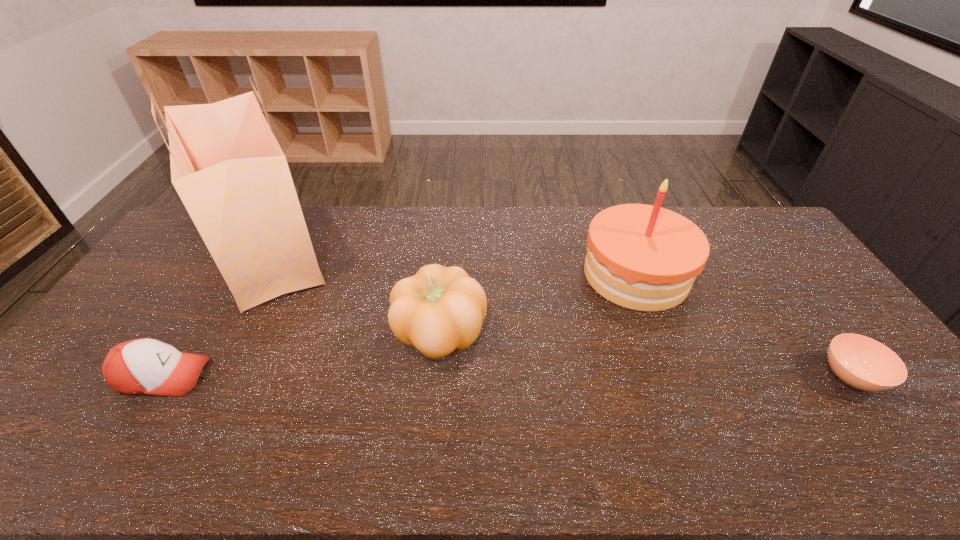
The image size is (960, 540). Identify the location of vacant space at the near edge of the desktop. (365, 455).

In the image, there is a desktop. At what (x,y) coordinates should I click in order to perform the action: click on vacant area at the left edge. Please return your answer as a coordinate pair (x, y). Image resolution: width=960 pixels, height=540 pixels. Looking at the image, I should click on (194, 260).

In the image, there is a desktop. What are the coordinates of `vacant space at the right edge` in the screenshot? It's located at (839, 316).

Find the location of a particular element. blank area at the far right corner is located at coordinates (762, 238).

At what (x,y) coordinates should I click in order to perform the action: click on vacant space in between the shortest object and the fourth tallest object. Please return your answer as a coordinate pair (x, y). This screenshot has width=960, height=540. Looking at the image, I should click on (508, 376).

This screenshot has width=960, height=540. In order to click on free space between the soup bowl and the tallest object in this screenshot , I will do `click(561, 315)`.

You are a GUI agent. You are given a task and a screenshot of the screen. Output one action in this format:
    pyautogui.click(x=<x>, y=<y>)
    Task: Click on the empty location between the baseball cap and the grocery bag
    This screenshot has height=540, width=960.
    Given the screenshot: What is the action you would take?
    pyautogui.click(x=217, y=315)

Identify the location of vacant area that lies between the tallest object and the second object from right to left. (453, 264).

Locate an element on the screen. free space that is in between the fourth tallest object and the pumpkin is located at coordinates (302, 354).

The width and height of the screenshot is (960, 540). I want to click on free area in between the tallest object and the third tallest object, so click(355, 293).